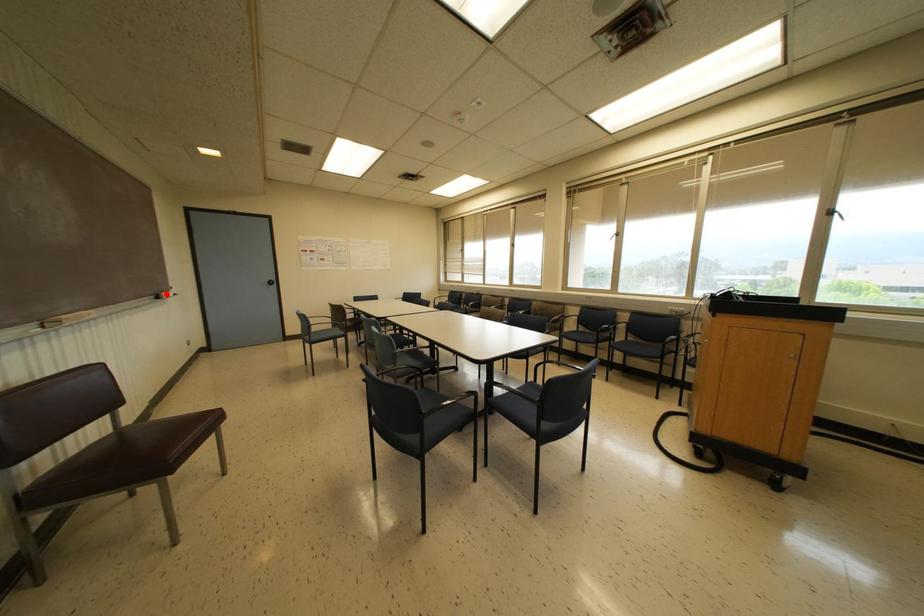
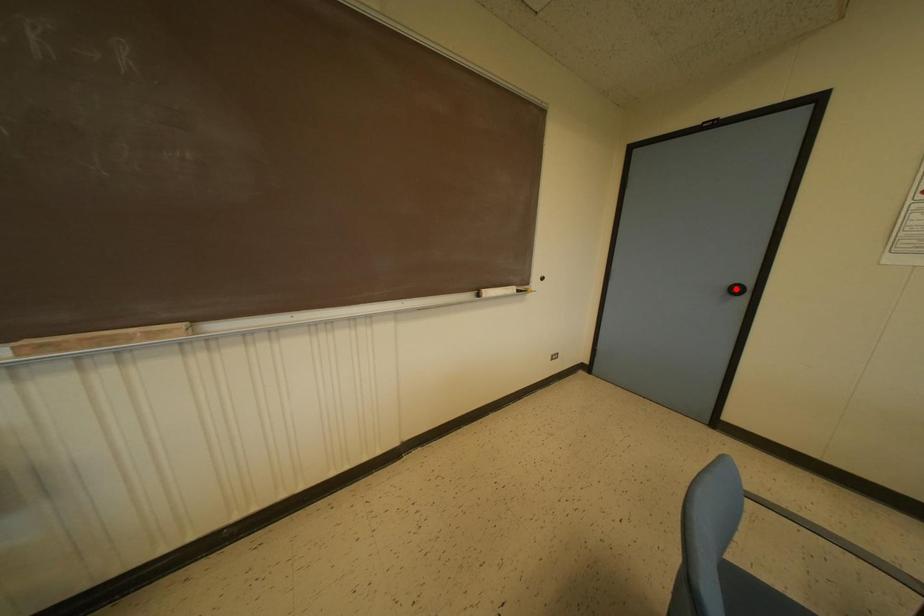
From the picture: I am providing you with two images of the same scene from different viewpoints. A red point is marked on the first image and another point is marked on the second image. Is the red point in image1 aligned with the point shown in image2?

No